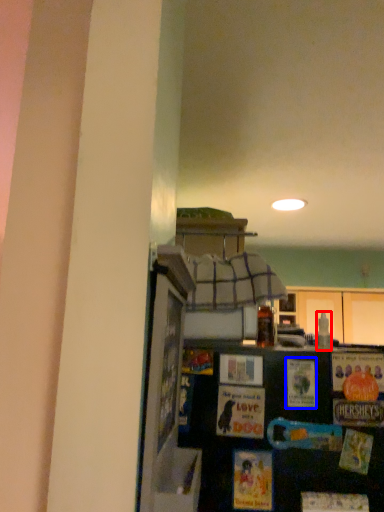
Question: Which of the following is the closest to the observer, bottle (highlighted by a red box) or postcard (highlighted by a blue box)?

Choices:
 (A) bottle
 (B) postcard

Answer: (B)